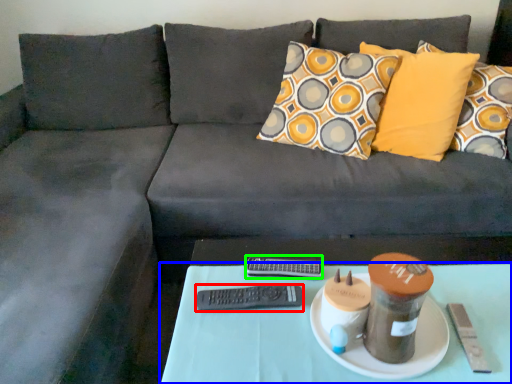
Question: Considering the real-world distances, which object is farthest from remote (highlighted by a red box)? table (highlighted by a blue box) or remote (highlighted by a green box)?

Choices:
 (A) table
 (B) remote

Answer: (A)